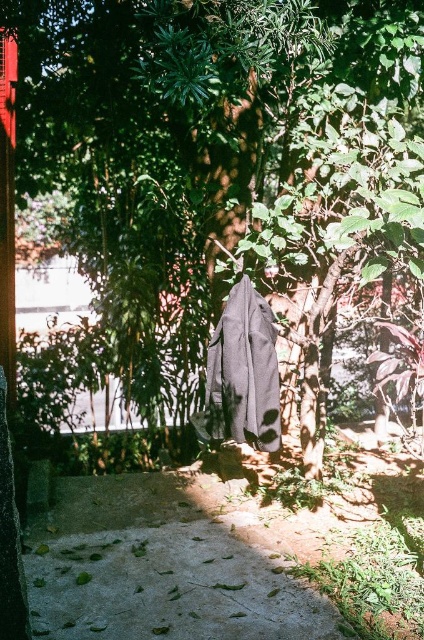
Question: Does green leafy tree at center have a larger size compared to concrete at lower center?

Choices:
 (A) yes
 (B) no

Answer: (A)

Question: Is green leafy tree at center below dark gray fabric robe at center?

Choices:
 (A) no
 (B) yes

Answer: (A)

Question: Is green leafy tree at center bigger than dark gray fabric robe at center?

Choices:
 (A) no
 (B) yes

Answer: (B)

Question: Which point is farther to the camera?

Choices:
 (A) dark gray fabric robe at center
 (B) green leafy tree at center

Answer: (A)

Question: Which object is positioned farthest from the green leafy tree at center?

Choices:
 (A) dark gray fabric robe at center
 (B) concrete at lower center

Answer: (B)

Question: Which point is farther from the camera taking this photo?

Choices:
 (A) (278, 134)
 (B) (137, 550)

Answer: (A)